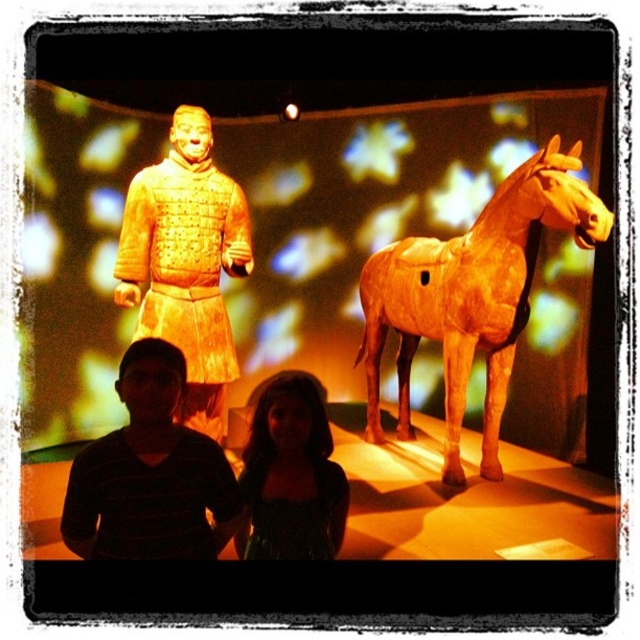
Question: Considering the real-world distances, which object is farthest from the black striped shirt at lower left?

Choices:
 (A) matte gold armor at upper left
 (B) dark green fabric dress at lower center

Answer: (A)

Question: Does matte gold horse at right come behind matte gold armor at upper left?

Choices:
 (A) yes
 (B) no

Answer: (A)

Question: Does matte gold horse at right have a lesser width compared to dark green fabric dress at lower center?

Choices:
 (A) no
 (B) yes

Answer: (A)

Question: Which of the following is the closest to the observer?

Choices:
 (A) dark green fabric dress at lower center
 (B) black striped shirt at lower left
 (C) matte gold horse at right

Answer: (B)

Question: Which point is farther from the camera taking this photo?

Choices:
 (A) (392, 244)
 (B) (124, 401)

Answer: (A)

Question: Is matte gold armor at upper left in front of black striped shirt at lower left?

Choices:
 (A) no
 (B) yes

Answer: (A)